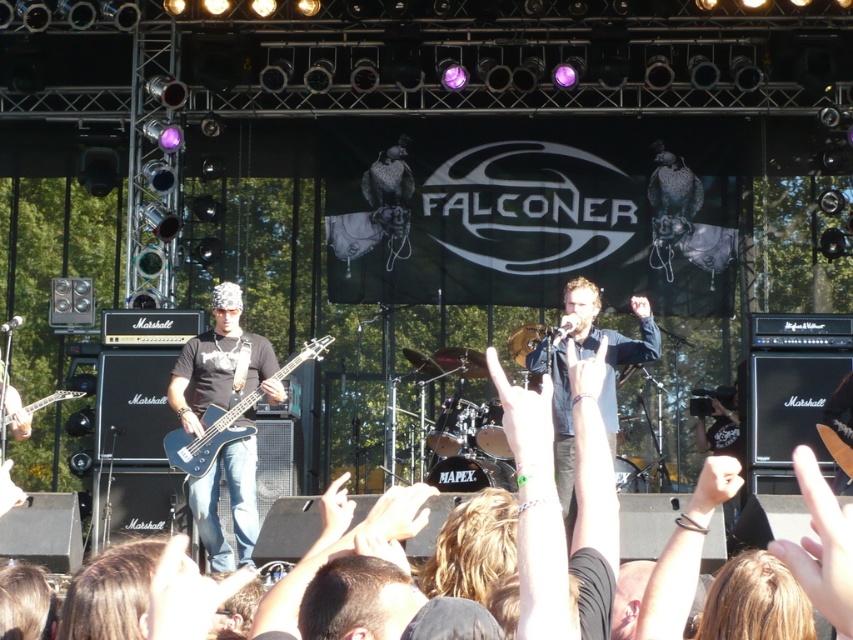
Question: Does matte black guitar at left have a smaller size compared to denim shorts at center?

Choices:
 (A) no
 (B) yes

Answer: (B)

Question: Which point is closer to the camera taking this photo?

Choices:
 (A) (187, 406)
 (B) (607, 378)

Answer: (B)

Question: Which of these objects is positioned farthest from the matte black guitar at left?

Choices:
 (A) denim shorts at center
 (B) glossy black electric guitar at left

Answer: (A)

Question: Is matte black guitar at left smaller than glossy black electric guitar at left?

Choices:
 (A) yes
 (B) no

Answer: (A)

Question: Which is farther from the glossy black electric guitar at left?

Choices:
 (A) matte black guitar at left
 (B) denim shorts at center

Answer: (B)

Question: Can you confirm if denim shorts at center is positioned to the right of glossy black electric guitar at left?

Choices:
 (A) no
 (B) yes

Answer: (B)